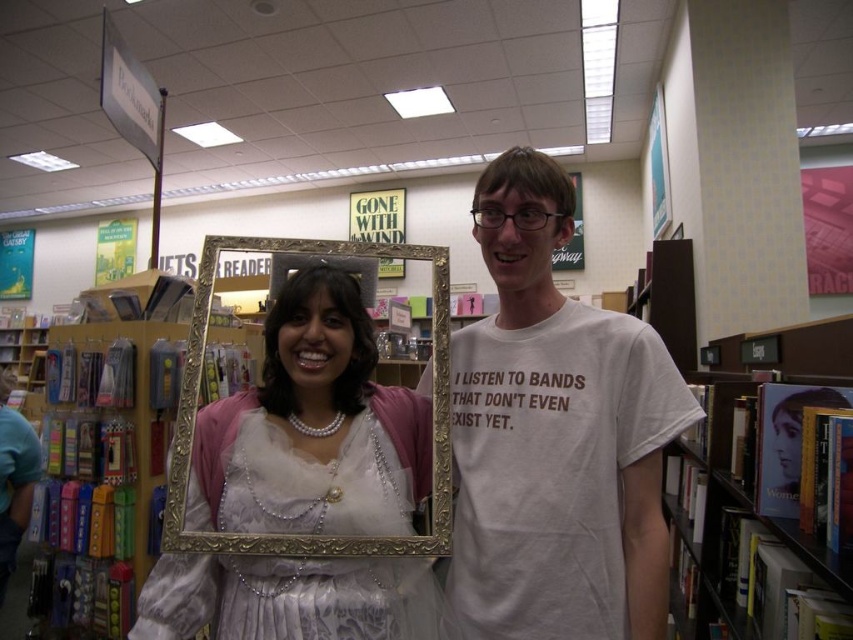
You are standing in the bookstore and see two points marked in the image. Which point is closer to you, point (x=311, y=632) or point (x=42, y=417)?

Point (x=311, y=632) is closer to the viewer than point (x=42, y=417).